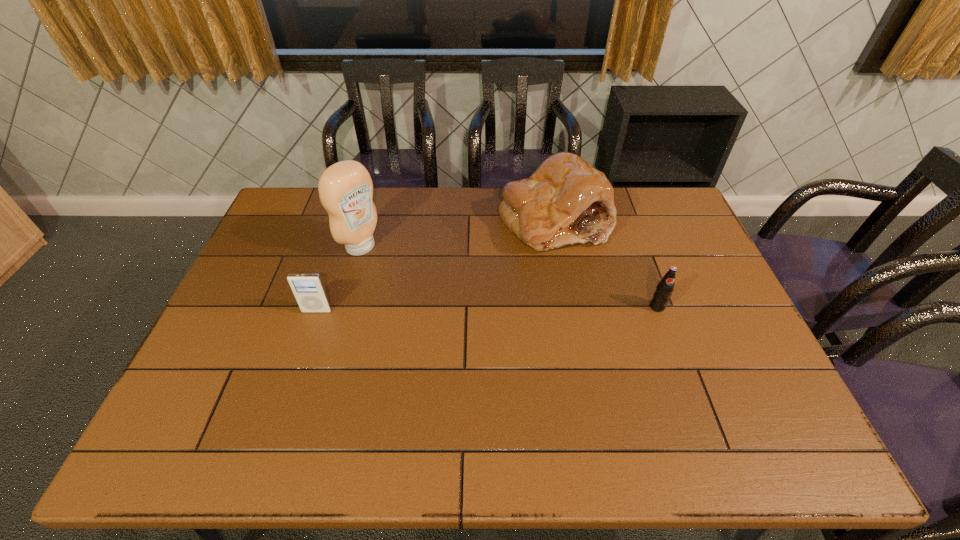
Find the location of a particular element. This screenshot has height=540, width=960. vacant space on the desktop that is between the iPod and the rightmost object and is positioned on the label of the condiment is located at coordinates (451, 309).

In order to click on vacant spot on the desktop that is between the iPod and the rightmost object and is positioned on the filling side of the third shortest object in this screenshot , I will do `click(535, 308)`.